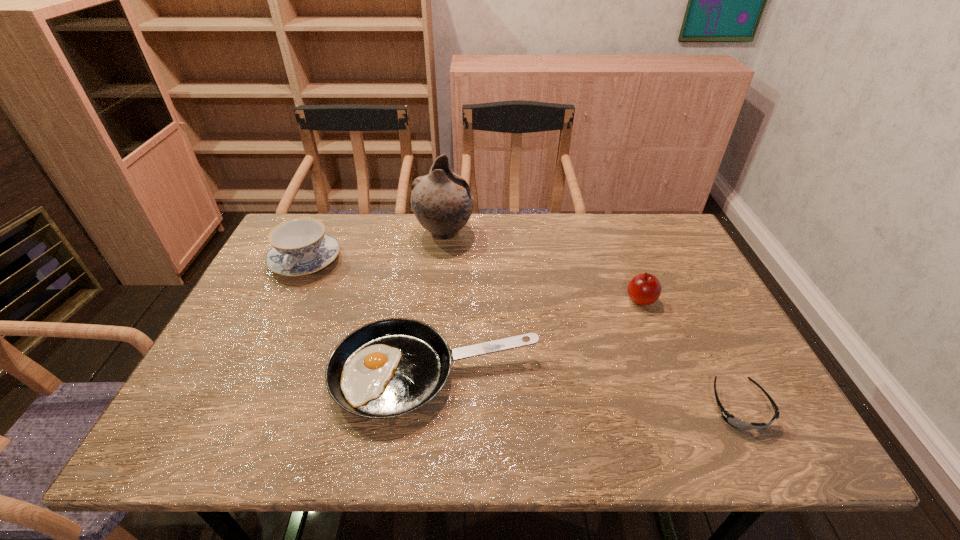
In the image, there is a desktop. In order to click on vacant space at the far edge in this screenshot , I will do `click(466, 258)`.

Image resolution: width=960 pixels, height=540 pixels. Identify the location of blank space at the near edge of the desktop. (305, 451).

Locate an element on the screen. The image size is (960, 540). vacant space at the left edge of the desktop is located at coordinates (276, 345).

Where is `vacant space at the right edge`? This screenshot has height=540, width=960. vacant space at the right edge is located at coordinates (746, 401).

In order to click on blank space at the far right corner in this screenshot , I will do `click(676, 254)`.

The image size is (960, 540). What are the coordinates of `vacant area between the sunglasses and the pottery` in the screenshot? It's located at (592, 320).

Where is `vacant area that lies between the third farthest object and the pottery`? vacant area that lies between the third farthest object and the pottery is located at coordinates (542, 266).

At what (x,y) coordinates should I click in order to perform the action: click on vacant area between the third farthest object and the shortest object. Please return your answer as a coordinate pair (x, y). The image size is (960, 540). Looking at the image, I should click on (690, 354).

You are a GUI agent. You are given a task and a screenshot of the screen. Output one action in this format:
    pyautogui.click(x=<x>, y=<y>)
    Task: Click on the free space between the shortest object and the second shortest object
    The height and width of the screenshot is (540, 960).
    Given the screenshot: What is the action you would take?
    pyautogui.click(x=588, y=391)

I want to click on empty space between the second shortest object and the leftmost object, so click(371, 318).